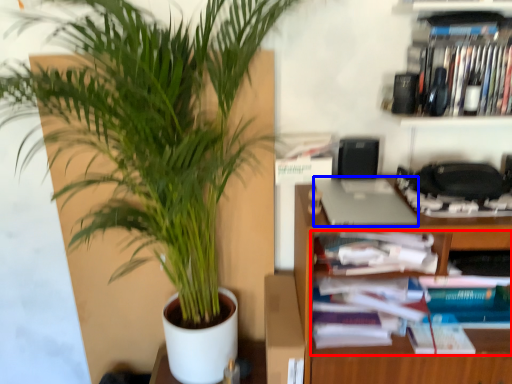
Question: Which object appears farthest to the camera in this image, book (highlighted by a red box) or laptop (highlighted by a blue box)?

Choices:
 (A) book
 (B) laptop

Answer: (A)